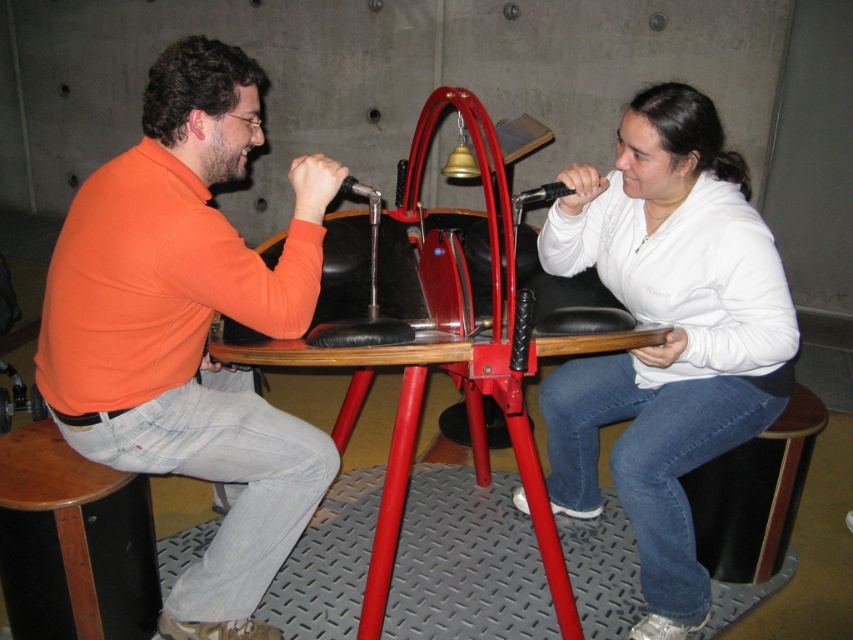
You are designing a new outfit for a character in a game. The character will wear the orange cotton shirt at left and the white fleece at center. Which clothing item should you choose if you want the character to look more compact?

The orange cotton shirt at left has a smaller size compared to the white fleece at center, so choosing the orange cotton shirt at left would make the character look more compact.